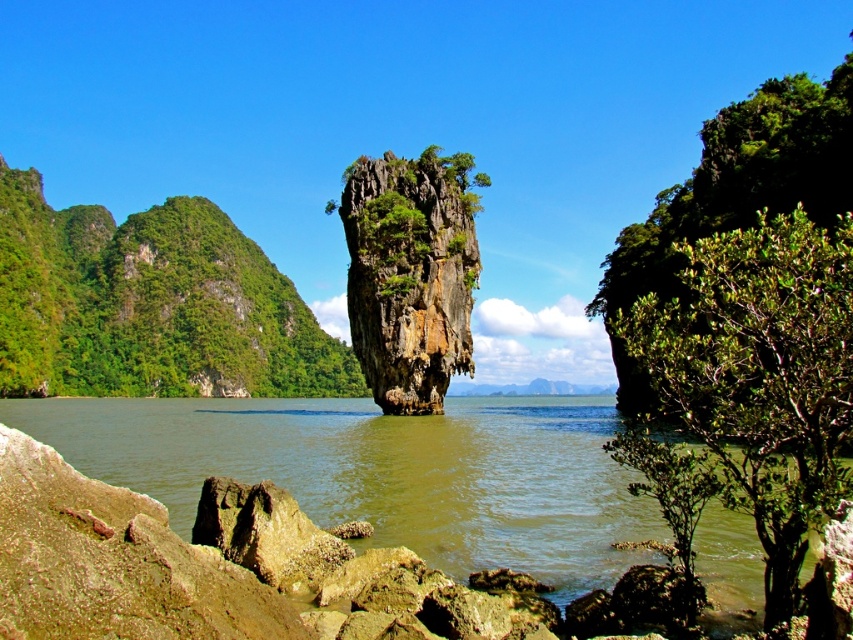
Can you confirm if green leafy tree at left is positioned below green leafy shrub at right?

No.

Is green leafy tree at left to the left of green leafy shrub at right from the viewer's perspective?

Yes, green leafy tree at left is to the left of green leafy shrub at right.

Between point (292, 346) and point (838, 464), which one is positioned behind?

The point (292, 346) is more distant.

At what (x,y) coordinates should I click in order to perform the action: click on green leafy tree at left. Please return your answer as a coordinate pair (x, y). Image resolution: width=853 pixels, height=640 pixels. Looking at the image, I should click on (151, 305).

Does green leafy shrub at right appear on the right side of rusty brown rock at center?

Indeed, green leafy shrub at right is positioned on the right side of rusty brown rock at center.

What do you see at coordinates (761, 376) in the screenshot? This screenshot has width=853, height=640. I see `green leafy shrub at right` at bounding box center [761, 376].

Locate an element on the screen. The image size is (853, 640). green leafy shrub at right is located at coordinates (761, 376).

Is greenish water at center further to the viewer compared to green leafy tree at left?

No, it is not.

Is point (379, 484) farther from camera compared to point (112, 317)?

No, it is in front of (112, 317).

Find the location of a particular element. greenish water at center is located at coordinates (383, 470).